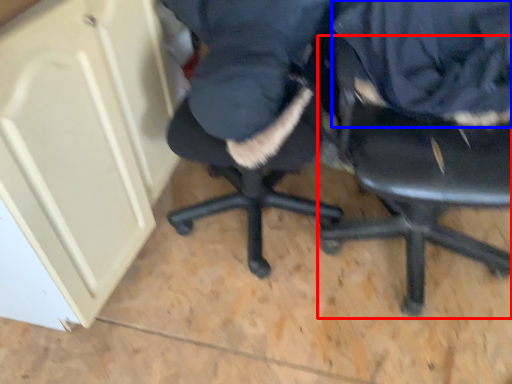
Question: Which point is closer to the camera, chair (highlighted by a red box) or clothing (highlighted by a blue box)?

Choices:
 (A) chair
 (B) clothing

Answer: (A)